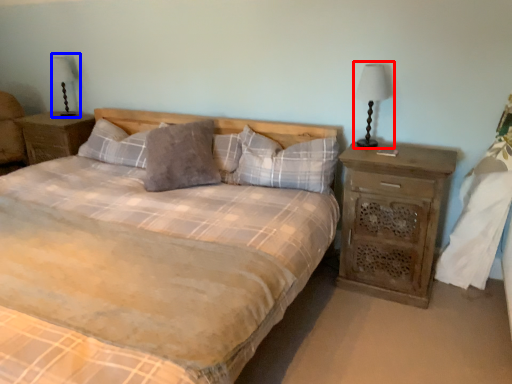
Question: Which of the following is the farthest to the observer, bedside lamp (highlighted by a red box) or table lamp (highlighted by a blue box)?

Choices:
 (A) bedside lamp
 (B) table lamp

Answer: (B)